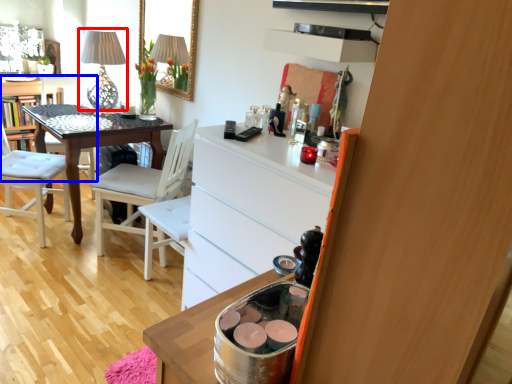
Question: Which of the following is the closest to the observer, table lamp (highlighted by a red box) or chair (highlighted by a blue box)?

Choices:
 (A) table lamp
 (B) chair

Answer: (A)